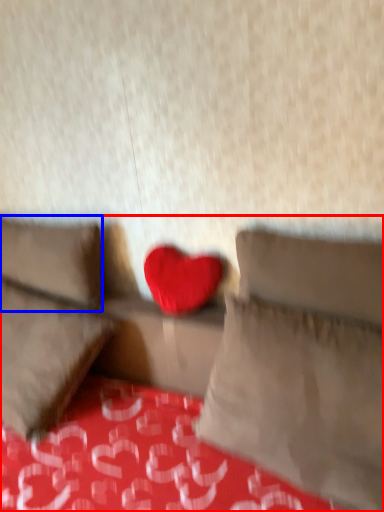
Question: Which point is further to the camera, studio couch (highlighted by a red box) or pillow (highlighted by a blue box)?

Choices:
 (A) studio couch
 (B) pillow

Answer: (B)